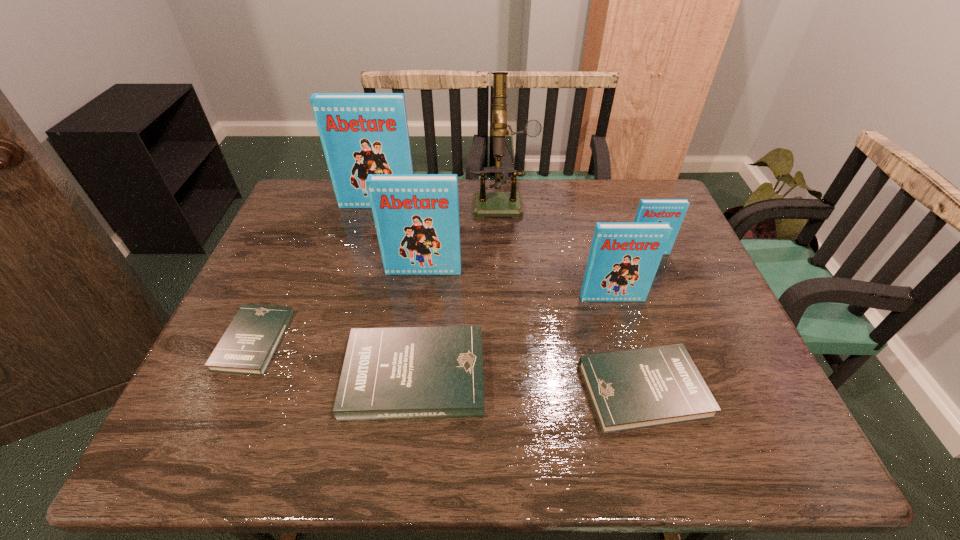
In the image, there is a desktop. Where is `free space at the far right corner`? This screenshot has width=960, height=540. free space at the far right corner is located at coordinates (640, 191).

You are a GUI agent. You are given a task and a screenshot of the screen. Output one action in this format:
    pyautogui.click(x=<x>, y=<y>)
    Task: Click on the free space between the smallest blue book and the sixth shortest object
    This screenshot has width=960, height=540.
    Given the screenshot: What is the action you would take?
    pyautogui.click(x=536, y=262)

This screenshot has height=540, width=960. I want to click on free space between the fourth shortest book and the second shortest book, so click(x=645, y=321).

What are the coordinates of `blank region between the second farthest blue book and the third farthest blue book` in the screenshot? It's located at (536, 262).

Find the location of a particular element. This screenshot has height=540, width=960. vacant area between the second smallest dark book and the tallest book is located at coordinates (511, 298).

In order to click on free space between the second tallest book and the biggest dark book in this screenshot , I will do `click(420, 323)`.

At what (x,y) coordinates should I click in order to perform the action: click on free area in between the second dark book from left to right and the leftmost dark book. Please return your answer as a coordinate pair (x, y). The image size is (960, 540). Looking at the image, I should click on (334, 358).

Locate an element on the screen. free spot between the biggest blue book and the fourth farthest book is located at coordinates (495, 252).

You are a GUI agent. You are given a task and a screenshot of the screen. Output one action in this format:
    pyautogui.click(x=<x>, y=<y>)
    Task: Click on the free space between the leftmost object and the brown microscope
    
    Given the screenshot: What is the action you would take?
    pyautogui.click(x=378, y=271)

This screenshot has height=540, width=960. In order to click on object that is the closest to the smallest blue book in this screenshot , I will do `click(624, 257)`.